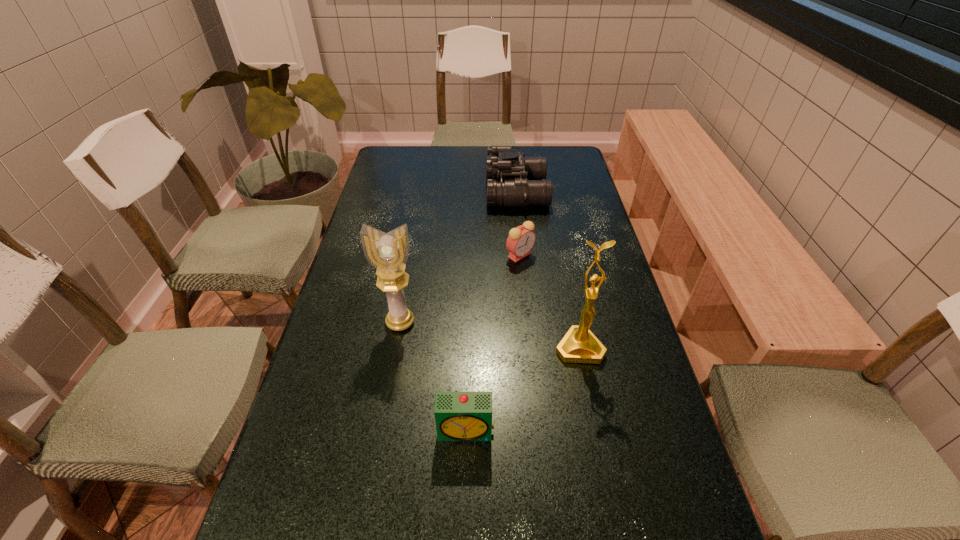
In order to click on the right award in this screenshot , I will do `click(579, 345)`.

The image size is (960, 540). In order to click on the left award in this screenshot , I will do tap(388, 253).

The image size is (960, 540). Identify the location of the third tallest object. (513, 180).

This screenshot has height=540, width=960. I want to click on the farthest object, so click(513, 180).

I want to click on the nearest object, so click(x=459, y=416).

I want to click on the nearer alarm clock, so click(x=459, y=416).

Where is `the farther alarm clock`? the farther alarm clock is located at coordinates (521, 239).

The width and height of the screenshot is (960, 540). I want to click on the right alarm clock, so 521,239.

Locate an element on the screen. Image resolution: width=960 pixels, height=540 pixels. vacant area situated on the front-facing side of the right award is located at coordinates (617, 533).

Where is `free region located 0.100m on the front-facing side of the left award`? free region located 0.100m on the front-facing side of the left award is located at coordinates (393, 366).